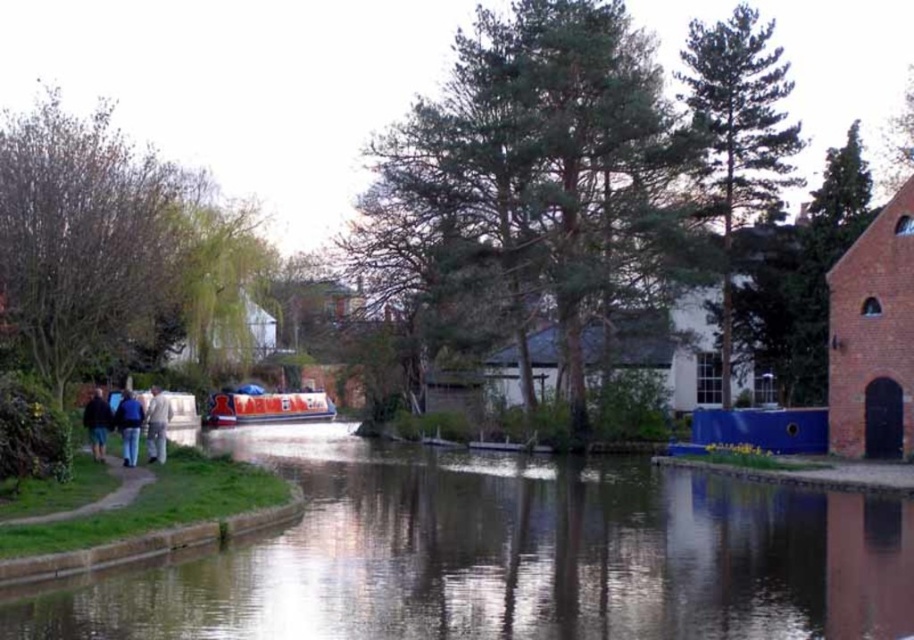
You are a photographer standing on the grassy path near the canal. You see the white cotton pants at left and the dark blue jeans at lower left. Which clothing item is positioned lower in the scene?

The white cotton pants at left is located below dark blue jeans at lower left, so the white cotton pants at left is positioned lower in the scene.

Consider the image. You are standing at the edge of the canal and notice the smooth reflective water at center and the dark blue jeans at lower left. Which object is lower in height?

The smooth reflective water at center has a lesser height compared to dark blue jeans at lower left, so the smooth reflective water at center is lower in height.

Based on the photo, you are standing at the point closer to the camera in the canal scene. Which point are you at, point (319, 410) or point (126, 448)?

You are at point (126, 448) because it is closer to the viewer than point (319, 410).